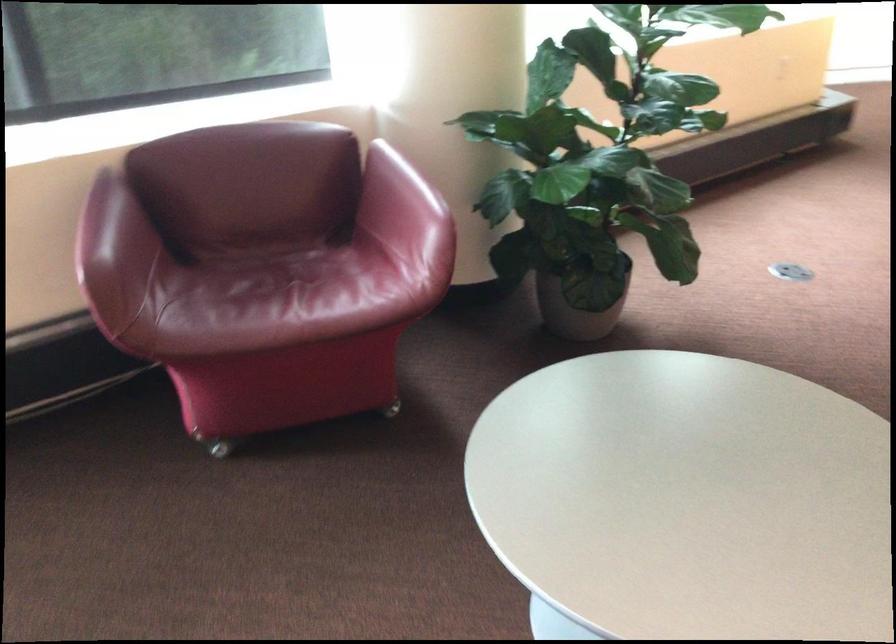
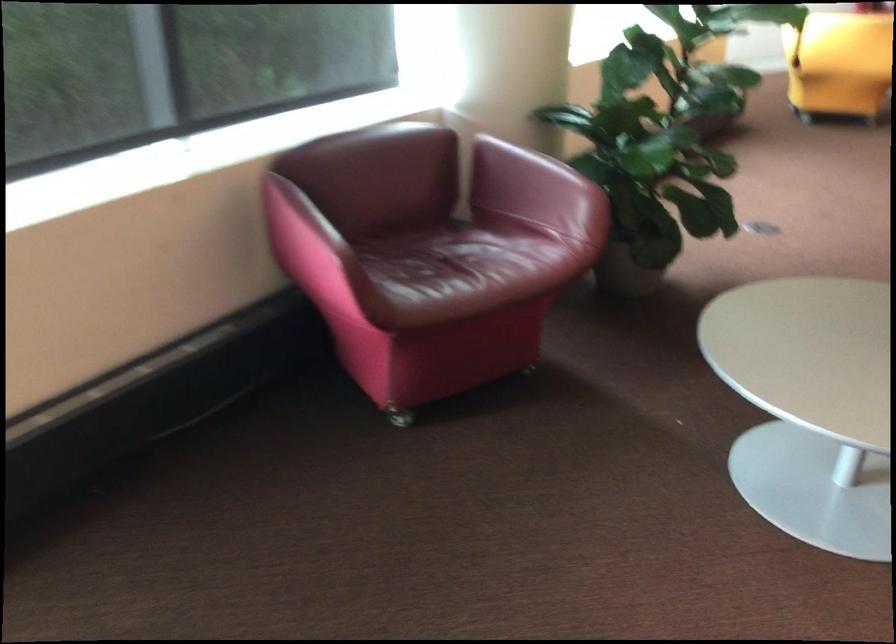
The point at (302, 223) is marked in the first image. Where is the corresponding point in the second image?

(426, 212)